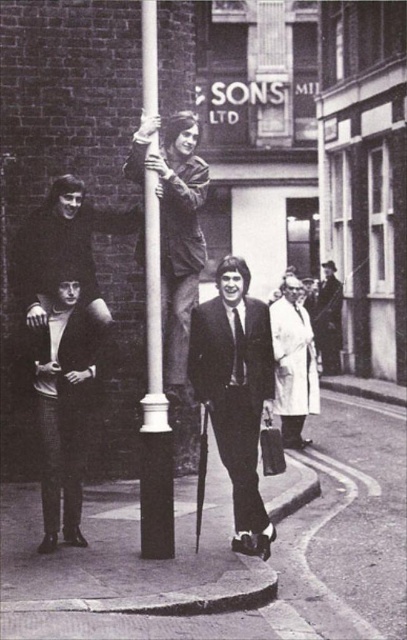
Question: Which point is farther from the camera taking this photo?

Choices:
 (A) (174, 371)
 (B) (214, 312)
 (C) (89, 292)
 (D) (334, 291)

Answer: (D)

Question: Among these points, which one is farthest from the camera?

Choices:
 (A) (100, 321)
 (B) (341, 307)
 (C) (162, 179)
 (D) (144, 109)

Answer: (B)

Question: Is white glossy pole at center to the left of smooth black suit at lower left from the viewer's perspective?

Choices:
 (A) yes
 (B) no

Answer: (B)

Question: Which point is farther to the camera?

Choices:
 (A) (144, 17)
 (B) (74, 266)
 (C) (135, 148)
 (D) (247, 508)

Answer: (B)

Question: Does matte black jacket at lower left have a lesser width compared to white glossy pole at center?

Choices:
 (A) yes
 (B) no

Answer: (B)

Question: Can you confirm if leather jacket at upper center is thinner than white glossy pole at center?

Choices:
 (A) yes
 (B) no

Answer: (B)